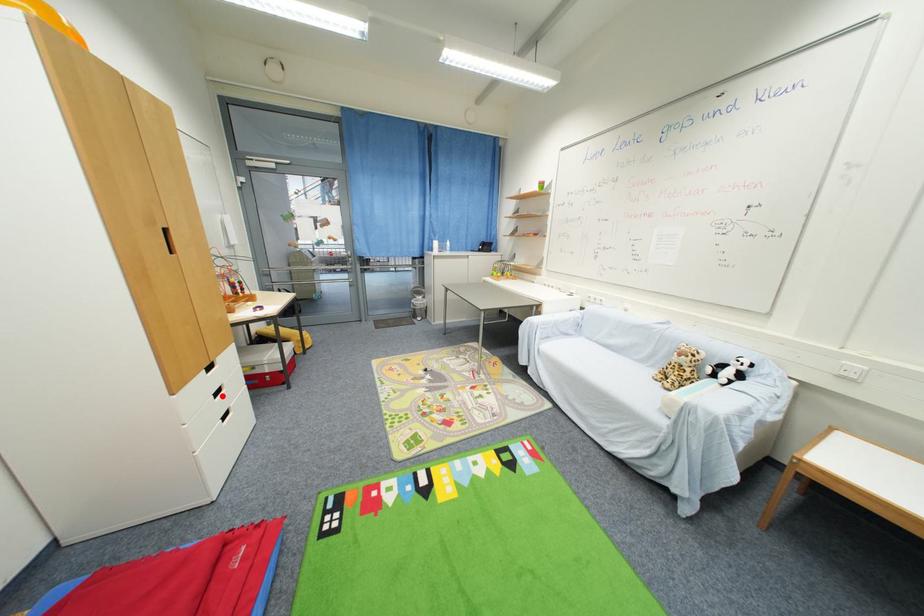
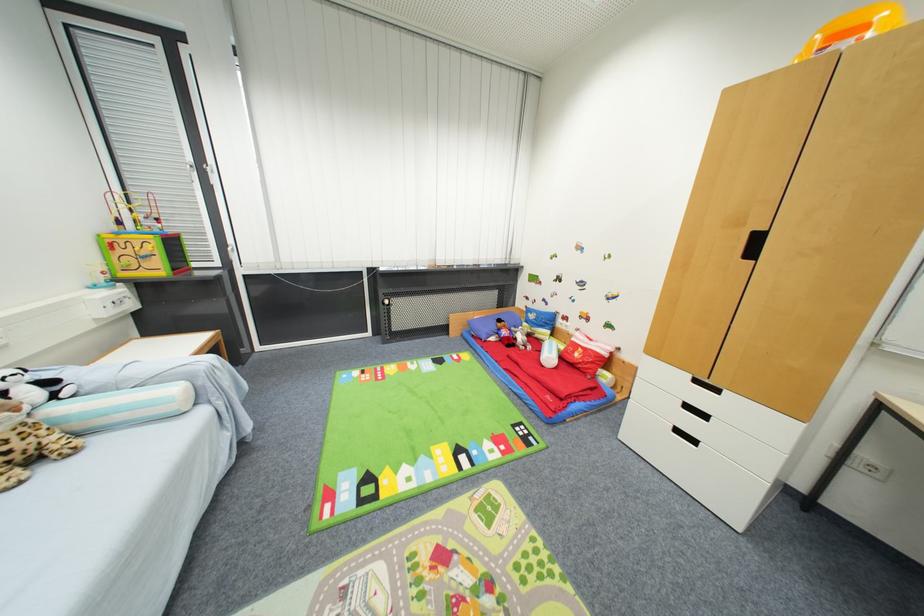
Question: I am providing you with two images of the same scene from different viewpoints. A red point is marked on the first image. Can you still see the location of the red point in image 2?

Choices:
 (A) Yes
 (B) No

Answer: (A)